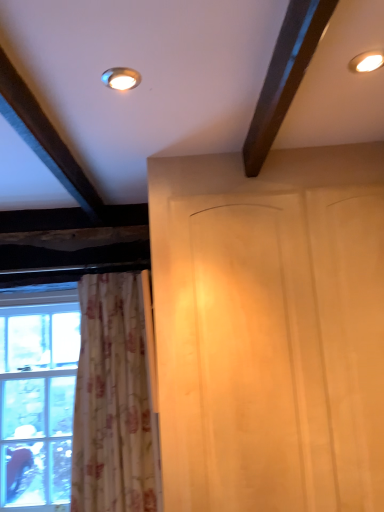
Question: Which is correct: matte gold light fixture at upper center, the 1th lighting positioned from the bottom, is inside white wood screen door at center, or outside of it?

Choices:
 (A) inside
 (B) outside

Answer: (B)

Question: In terms of width, does matte gold light fixture at upper center, positioned as the 1th lighting in left-to-right order, look wider or thinner when compared to white wood screen door at center?

Choices:
 (A) thin
 (B) wide

Answer: (A)

Question: Considering the real-world distances, which object is closest to the matte gold light fixture at upper center, positioned as the 1th lighting in left-to-right order?

Choices:
 (A) matte white light fixture at upper right, the 2th lighting from the left
 (B) clear glass window at left
 (C) white floral fabric curtain at left
 (D) white wood screen door at center

Answer: (A)

Question: Which object is the farthest from the matte gold light fixture at upper center, the 2th lighting when ordered from top to bottom?

Choices:
 (A) white wood screen door at center
 (B) clear glass window at left
 (C) white floral fabric curtain at left
 (D) matte white light fixture at upper right, the 2th lighting from the left

Answer: (B)